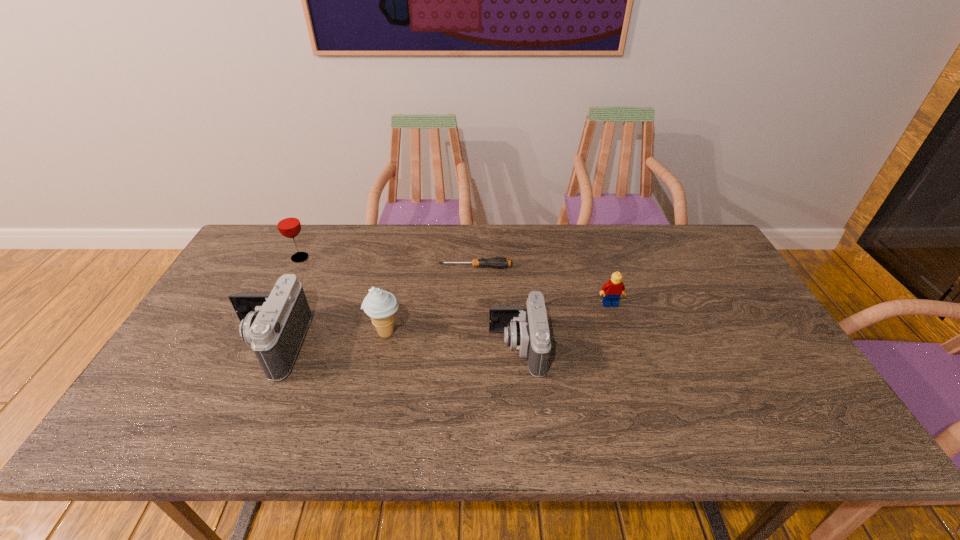
This screenshot has height=540, width=960. I want to click on vacant area between the third object from left to right and the shorter camera, so click(451, 341).

This screenshot has height=540, width=960. I want to click on object that is the third closest one to the left camera, so click(x=496, y=262).

The image size is (960, 540). In order to click on the closest object to the fourth nearest object in this screenshot , I will do `click(527, 330)`.

You are a GUI agent. You are given a task and a screenshot of the screen. Output one action in this format:
    pyautogui.click(x=<x>, y=<y>)
    Task: Click on the vacant region that satisfies the following two spatial constraints: 1. on the front-facing side of the third farthest object; 2. at the front of the right camera with an open lens cover
    
    Given the screenshot: What is the action you would take?
    pyautogui.click(x=624, y=348)